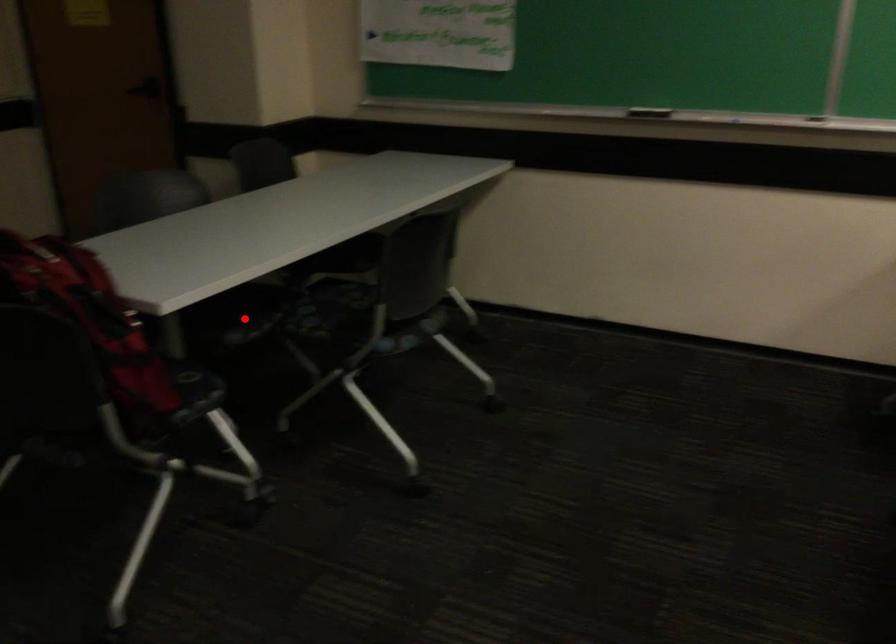
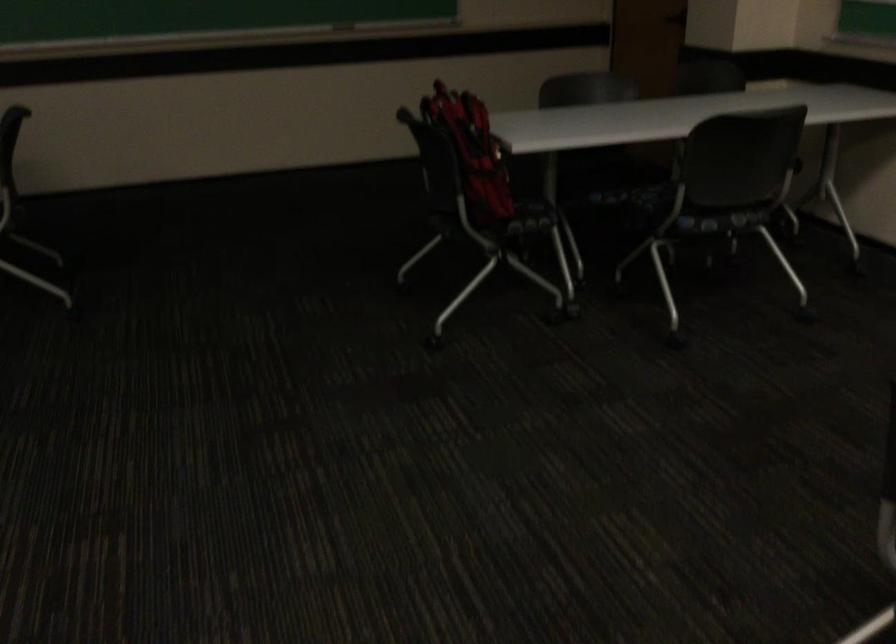
Where in the second image is the point corresponding to the highlighted location from the first image?

(612, 180)